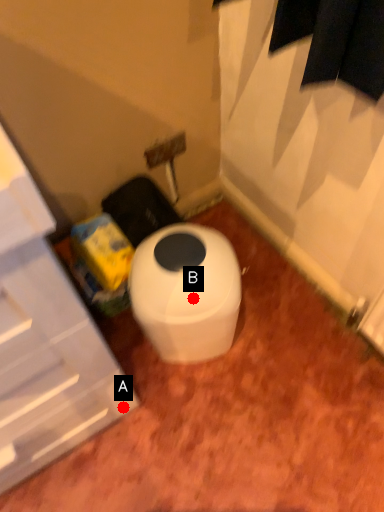
Question: Two points are circled on the image, labeled by A and B beside each circle. Which point appears closest to the camera in this image?

Choices:
 (A) A is closer
 (B) B is closer

Answer: (B)